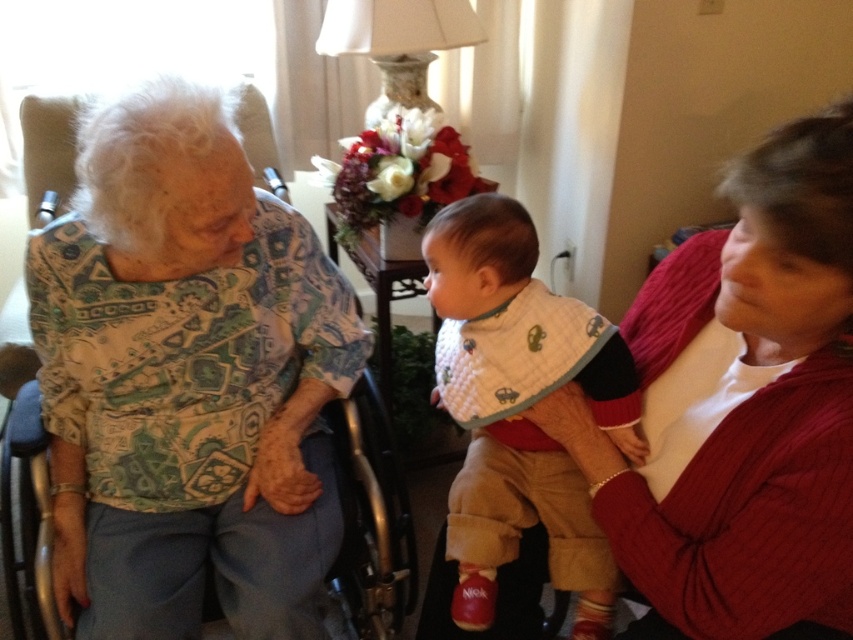
What is the color of the object located at point (741, 408) in the image?

The object at point (741, 408) is a matte red sweater at right.

You are a photographer trying to capture a closeup shot of the matte red sweater at right and the silver metallic wheelchair at left. Your camera can only focus on objects within 18 inches of each other. Based on the scene, will both objects be in focus?

The matte red sweater at right and silver metallic wheelchair at left are 19.62 inches apart from each other. Since the camera requires objects to be within 18 inches for focus, they are just beyond the threshold. Therefore, both objects cannot be in focus simultaneously.

You are a photographer trying to capture a closeup of the white quilted bib at center without the matte red sweater at right appearing in the shot. Based on their relative heights, can you position the camera so that the sweater is out of frame?

The matte red sweater at right has a lesser height compared to white quilted bib at center. Since the sweater is shorter, you can lower the camera angle so that the sweater is below the frame while keeping the bib in view.